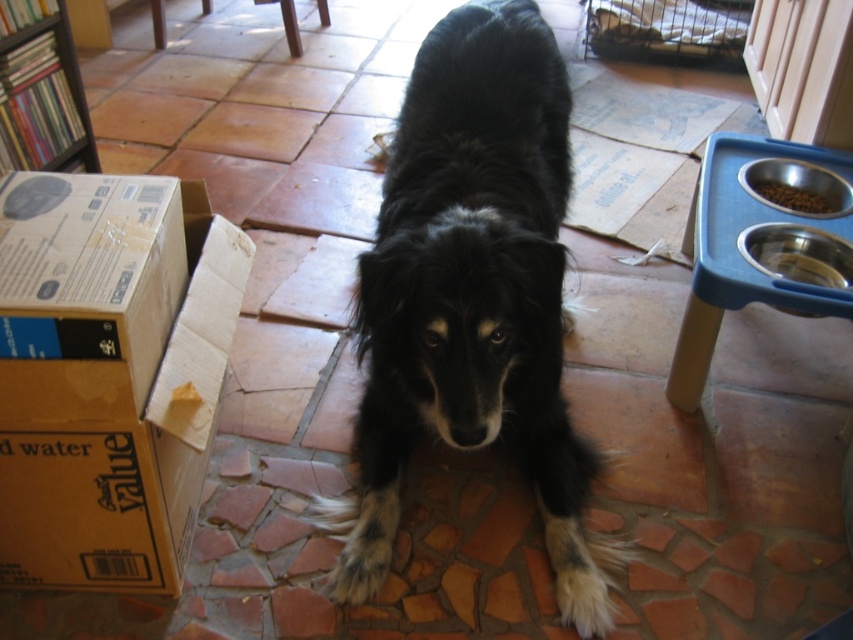
Is blue plastic pet feeder at right thinner than wooden bookshelf at upper left?

No, blue plastic pet feeder at right is not thinner than wooden bookshelf at upper left.

Does point (810, 259) come closer to viewer compared to point (49, 35)?

That is True.

Image resolution: width=853 pixels, height=640 pixels. I want to click on blue plastic pet feeder at right, so click(x=761, y=243).

Which is more to the left, black fur dog at center or blue plastic pet feeder at right?

black fur dog at center

Who is more forward, (503, 234) or (741, 230)?

Point (503, 234) is in front.

Does point (480, 420) come behind point (759, 232)?

No, (480, 420) is closer to viewer.

This screenshot has height=640, width=853. In order to click on black fur dog at center in this screenshot , I will do `click(473, 298)`.

Measure the distance between brown cardboard box at left and blue plastic pet feeder at right.

brown cardboard box at left and blue plastic pet feeder at right are 3.97 feet apart.

Is point (138, 294) closer to camera compared to point (741, 141)?

Yes, point (138, 294) is closer to viewer.

Between point (199, 264) and point (701, 324), which one is positioned behind?

The point (701, 324) is behind.

I want to click on brown cardboard box at left, so click(109, 372).